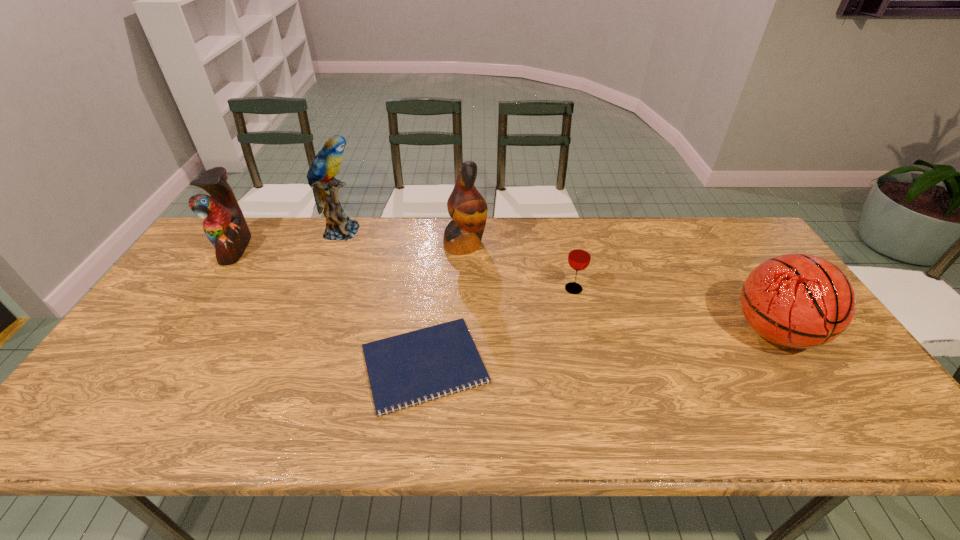
Identify the location of free space located at the face of the leftmost object. (335, 248).

Locate an element on the screen. free space located on the side with spill of the rightmost object is located at coordinates (817, 396).

Where is `vacant space situated 0.100m on the right of the second object from right to left`? vacant space situated 0.100m on the right of the second object from right to left is located at coordinates (618, 289).

Locate an element on the screen. The width and height of the screenshot is (960, 540). free spot located on the right of the notepad is located at coordinates (518, 364).

At what (x,y) coordinates should I click in order to perform the action: click on object that is at the near edge. Please return your answer as a coordinate pair (x, y). Looking at the image, I should click on (432, 362).

I want to click on object that is at the left edge, so click(224, 225).

At what (x,y) coordinates should I click in order to perform the action: click on object at the right edge. Please return your answer as a coordinate pair (x, y). This screenshot has height=540, width=960. Looking at the image, I should click on (795, 300).

Locate an element on the screen. object located in the far left corner section of the desktop is located at coordinates (224, 225).

This screenshot has height=540, width=960. I want to click on free region at the far edge of the desktop, so click(x=540, y=239).

I want to click on free space at the near edge of the desktop, so click(368, 415).